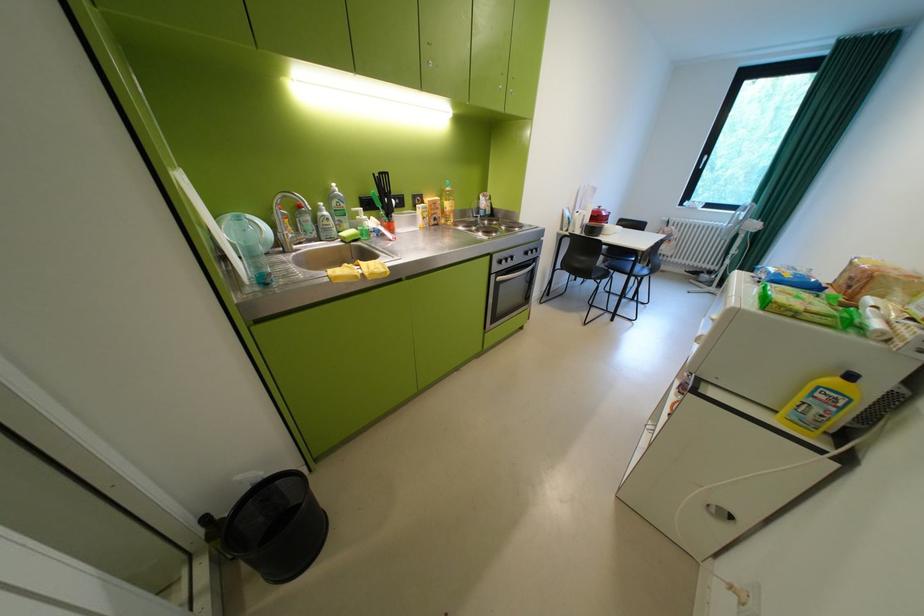
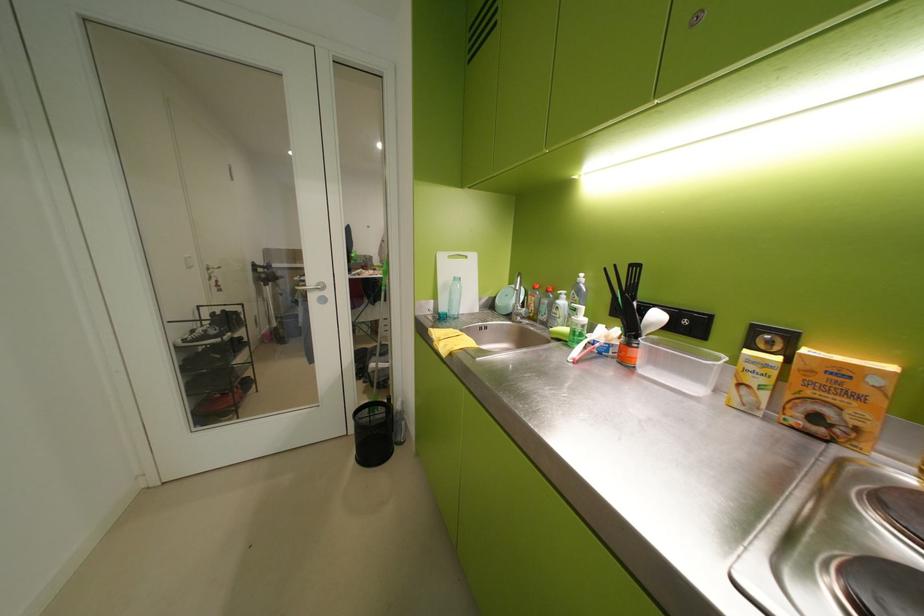
Where in the second image is the point corresponding to (x=444, y=204) from the first image?

(852, 373)